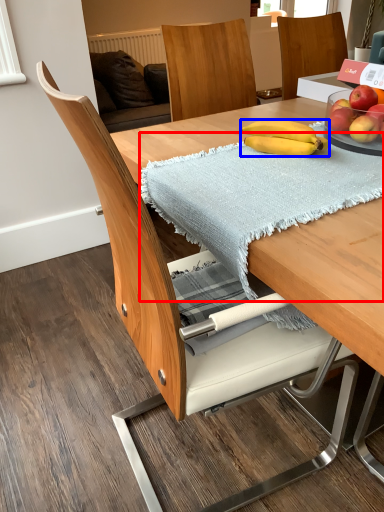
Question: Which object is further to the camera taking this photo, blanket (highlighted by a red box) or banana (highlighted by a blue box)?

Choices:
 (A) blanket
 (B) banana

Answer: (B)